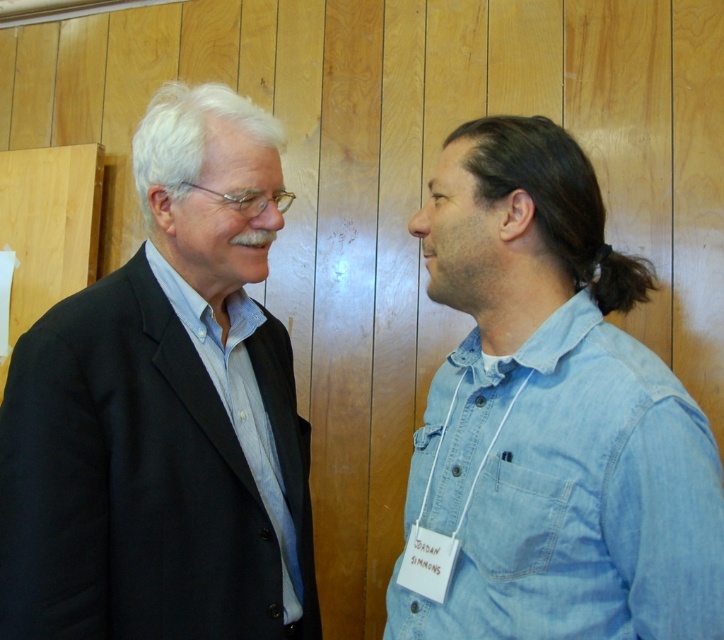
You are organizing a photo shoot and need to arrange two models wearing the black matte suit at left and denim shirt at right. According to the image, which model should stand on the left side of the photo to match the original scene?

The model wearing the black matte suit at left should be placed on the left side of the photo because the black matte suit at left is to the left of denim shirt at right in the original scene.

You are standing in the room and want to place a new painting on the wall. The painting must be placed exactly where the black matte suit at left is currently located. What coordinates should you use for the painting?

The coordinates for the black matte suit at left are at point (164, 412), so you should place the painting at those coordinates.

You are standing at the camera position and want to reach the point marked as point [70,529]. If you take a step forward of 3 feet, will you be closer to the point?

The distance between point [70,529] and the camera is 37.69 inches. Since 3 feet is equal to 36 inches, stepping forward by 3 feet would bring you to within 1.69 inches of the point, so yes, you would be closer.